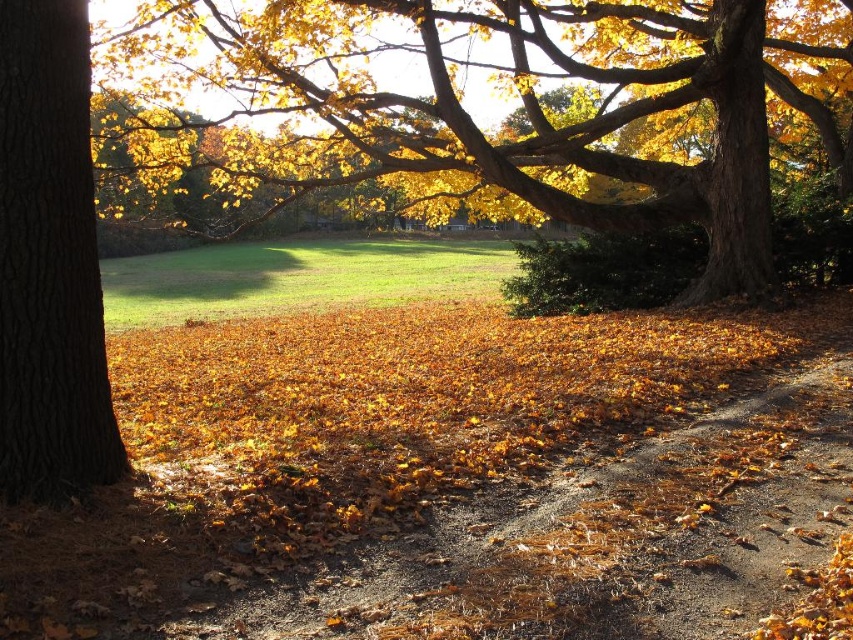
Who is higher up, brown gravel path at center or brown rough bark tree at left?

brown rough bark tree at left is higher up.

Is brown gravel path at center shorter than brown rough bark tree at left?

Correct, brown gravel path at center is not as tall as brown rough bark tree at left.

Is point (238, 624) more distant than point (73, 243)?

No.

Where is `brown gravel path at center`? Image resolution: width=853 pixels, height=640 pixels. brown gravel path at center is located at coordinates (604, 540).

Which of these two, golden leafy tree at center or brown rough bark tree at left, stands shorter?

brown rough bark tree at left

Who is more distant from viewer, (514,92) or (45,214)?

The point (514,92) is more distant.

Find the location of `golden leafy tree at center`. golden leafy tree at center is located at coordinates (508, 92).

Is golden leafy tree at center closer to camera compared to brown gravel path at center?

No, golden leafy tree at center is further to the viewer.

Can you confirm if golden leafy tree at center is positioned above brown gravel path at center?

Correct, golden leafy tree at center is located above brown gravel path at center.

Describe the element at coordinates (508, 92) in the screenshot. This screenshot has width=853, height=640. I see `golden leafy tree at center` at that location.

Find the location of a particular element. The height and width of the screenshot is (640, 853). golden leafy tree at center is located at coordinates point(508,92).